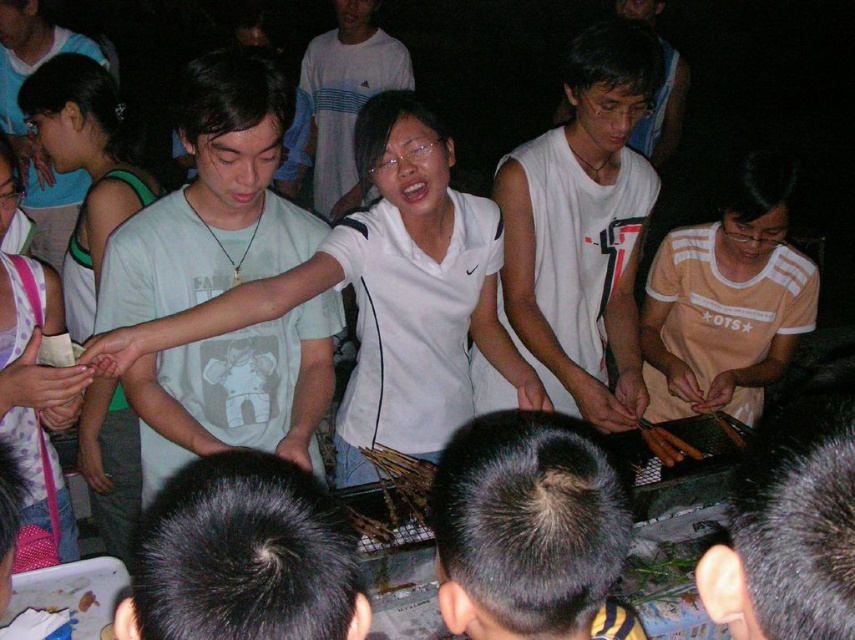
What is the color and location of the object at point (211, 200)?

The object at point (211, 200) is a light gray t shirt at center.

You are a photographer at the event and want to capture the white jersey at center and the brown crispy chicken at center in the same frame. Which object should you focus on first to ensure both are in focus?

The white jersey at center is located above the brown crispy chicken at center. To ensure both are in focus, focus on the white jersey at center first since it is closer to the camera.